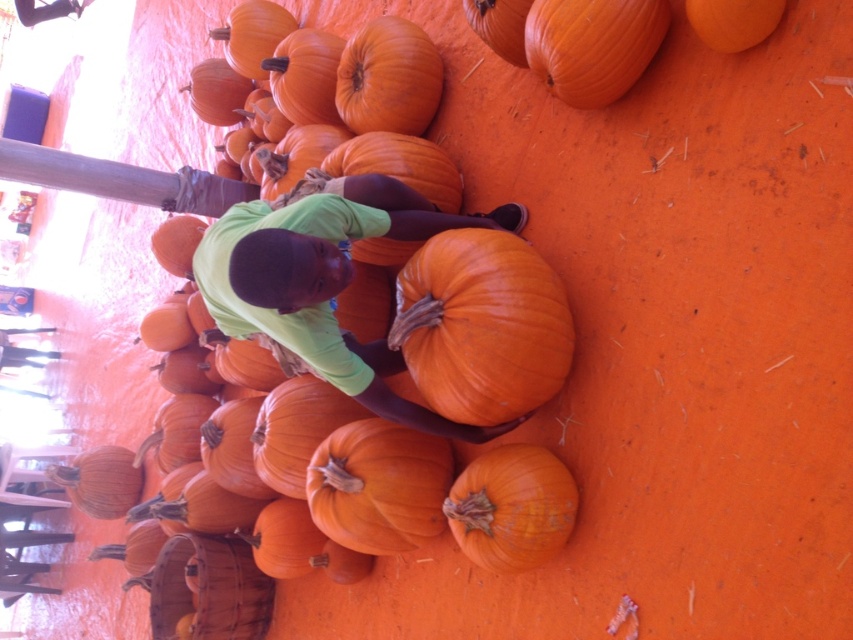
You are standing in front of the pumpkin display and need to find the smooth orange pumpkin at lower left. According to the coordinates provided, where exactly should you look to locate it?

The smooth orange pumpkin at lower left is located at point (100, 481), so you should look at that coordinate to find it.

You are standing in front of the pumpkin pile and want to pick up the orange matte pumpkin at upper right. Is it possible to reach it without moving the smooth orange pumpkin at center?

The orange matte pumpkin at upper right is behind the smooth orange pumpkin at center, so you cannot reach it without moving the smooth orange pumpkin at center first.

You are standing in front of the pumpkin pile and see two points marked in the image. The first point is at coordinate point (107, 502) and the second is at point (753, 3). Which point is closer to you?

Point (107, 502) is closer to you than point (753, 3) because it is further to the viewer according to the description.